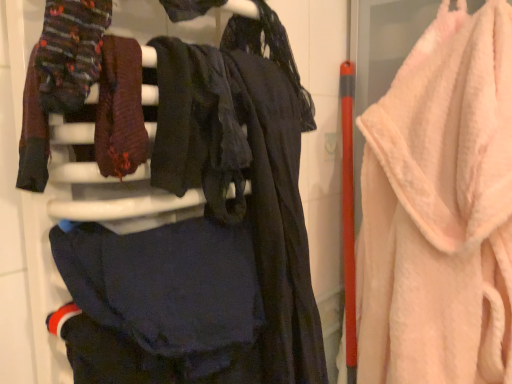
Locate an element on the screen. Image resolution: width=512 pixels, height=384 pixels. dark matte fabric at center, the 2th clothing in the top-to-bottom sequence is located at coordinates (160, 302).

Measure the distance between point (76,54) and camera.

Point (76,54) is 16.73 inches from camera.

Describe the element at coordinates (256, 264) in the screenshot. I see `velvet black dress at center` at that location.

This screenshot has width=512, height=384. I want to click on pink fluffy towel at right, so click(440, 209).

Is dark matte fabric at center, the 2th clothing in the top-to-bottom sequence, facing away from knitted wool socks at upper left, which is counted as the 2th clothing, starting from the bottom?

No, dark matte fabric at center, the 2th clothing in the top-to-bottom sequence, is not facing away from knitted wool socks at upper left, which is counted as the 2th clothing, starting from the bottom.

How many degrees apart are the facing directions of dark matte fabric at center, the 2th clothing in the top-to-bottom sequence, and knitted wool socks at upper left, arranged as the 1th clothing when viewed from the top?

0.000159 degrees separate the facing orientations of dark matte fabric at center, the 2th clothing in the top-to-bottom sequence, and knitted wool socks at upper left, arranged as the 1th clothing when viewed from the top.

From the image's perspective, who appears lower, dark matte fabric at center, which ranks as the 1th clothing in bottom-to-top order, or knitted wool socks at upper left, which is counted as the 2th clothing, starting from the bottom?

dark matte fabric at center, which ranks as the 1th clothing in bottom-to-top order, from the image's perspective.

Is dark matte fabric at center, the 2th clothing in the top-to-bottom sequence, not close to knitted wool socks at upper left, arranged as the 1th clothing when viewed from the top?

They are positioned close to each other.

Measure the distance between velvet black dress at center and knitted wool socks at upper left, which is counted as the 2th clothing, starting from the bottom.

velvet black dress at center is 8.48 inches from knitted wool socks at upper left, which is counted as the 2th clothing, starting from the bottom.

Is velvet black dress at center facing towards knitted wool socks at upper left, arranged as the 1th clothing when viewed from the top?

Yes, velvet black dress at center is facing knitted wool socks at upper left, arranged as the 1th clothing when viewed from the top.

Considering the positions of objects velvet black dress at center and knitted wool socks at upper left, which is counted as the 2th clothing, starting from the bottom, in the image provided, who is behind, velvet black dress at center or knitted wool socks at upper left, which is counted as the 2th clothing, starting from the bottom,?

velvet black dress at center is further from the camera.

Considering the sizes of objects velvet black dress at center and knitted wool socks at upper left, arranged as the 1th clothing when viewed from the top, in the image provided, who is bigger, velvet black dress at center or knitted wool socks at upper left, arranged as the 1th clothing when viewed from the top,?

velvet black dress at center is bigger.

Considering the relative sizes of pink fluffy towel at right and knitted wool socks at upper left, arranged as the 1th clothing when viewed from the top, in the image provided, is pink fluffy towel at right wider than knitted wool socks at upper left, arranged as the 1th clothing when viewed from the top,?

Yes, pink fluffy towel at right is wider than knitted wool socks at upper left, arranged as the 1th clothing when viewed from the top.

From a real-world perspective, is pink fluffy towel at right physically located above or below knitted wool socks at upper left, arranged as the 1th clothing when viewed from the top?

Clearly, from a real-world perspective, pink fluffy towel at right is below knitted wool socks at upper left, arranged as the 1th clothing when viewed from the top.

Is pink fluffy towel at right closer to camera compared to dark matte fabric at center, which ranks as the 1th clothing in bottom-to-top order?

No, pink fluffy towel at right is behind dark matte fabric at center, which ranks as the 1th clothing in bottom-to-top order.

Could you tell me if pink fluffy towel at right is facing dark matte fabric at center, which ranks as the 1th clothing in bottom-to-top order?

Yes, pink fluffy towel at right is aimed at dark matte fabric at center, which ranks as the 1th clothing in bottom-to-top order.

Who is taller, pink fluffy towel at right or dark matte fabric at center, the 2th clothing in the top-to-bottom sequence?

pink fluffy towel at right is taller.

Which is more to the right, pink fluffy towel at right or dark matte fabric at center, which ranks as the 1th clothing in bottom-to-top order?

pink fluffy towel at right is more to the right.

Considering the positions of objects knitted wool socks at upper left, which is counted as the 2th clothing, starting from the bottom, and pink fluffy towel at right in the image provided, who is more to the left, knitted wool socks at upper left, which is counted as the 2th clothing, starting from the bottom, or pink fluffy towel at right?

knitted wool socks at upper left, which is counted as the 2th clothing, starting from the bottom, is more to the left.

Looking at their sizes, would you say knitted wool socks at upper left, which is counted as the 2th clothing, starting from the bottom, is wider or thinner than pink fluffy towel at right?

In the image, knitted wool socks at upper left, which is counted as the 2th clothing, starting from the bottom, appears to be more narrow than pink fluffy towel at right.

Relative to pink fluffy towel at right, is knitted wool socks at upper left, which is counted as the 2th clothing, starting from the bottom, in front or behind?

Visually, knitted wool socks at upper left, which is counted as the 2th clothing, starting from the bottom, is located in front of pink fluffy towel at right.

Is dark matte fabric at center, the 2th clothing in the top-to-bottom sequence, next to velvet black dress at center and touching it?

Yes, the surface of dark matte fabric at center, the 2th clothing in the top-to-bottom sequence, is in contact with velvet black dress at center.

Is dark matte fabric at center, which ranks as the 1th clothing in bottom-to-top order, in front of velvet black dress at center?

No, the depth of dark matte fabric at center, which ranks as the 1th clothing in bottom-to-top order, is greater than that of velvet black dress at center.

Considering the sizes of dark matte fabric at center, which ranks as the 1th clothing in bottom-to-top order, and velvet black dress at center in the image, is dark matte fabric at center, which ranks as the 1th clothing in bottom-to-top order, wider or thinner than velvet black dress at center?

In the image, dark matte fabric at center, which ranks as the 1th clothing in bottom-to-top order, appears to be more narrow than velvet black dress at center.

Is dark matte fabric at center, the 2th clothing in the top-to-bottom sequence, positioned beyond the bounds of velvet black dress at center?

No, most part of dark matte fabric at center, the 2th clothing in the top-to-bottom sequence, lies within velvet black dress at center.

Could you tell me if dark matte fabric at center, the 2th clothing in the top-to-bottom sequence, is facing pink fluffy towel at right?

No, dark matte fabric at center, the 2th clothing in the top-to-bottom sequence, does not turn towards pink fluffy towel at right.

Does dark matte fabric at center, the 2th clothing in the top-to-bottom sequence, contain pink fluffy towel at right?

Actually, pink fluffy towel at right is outside dark matte fabric at center, the 2th clothing in the top-to-bottom sequence.

Who is taller, dark matte fabric at center, which ranks as the 1th clothing in bottom-to-top order, or pink fluffy towel at right?

Result: With more height is pink fluffy towel at right.

Can you confirm if dark matte fabric at center, which ranks as the 1th clothing in bottom-to-top order, is bigger than pink fluffy towel at right?

No.

At what (x,y) coordinates should I click in order to perform the action: click on clothing behind the knitted wool socks at upper left, which is counted as the 2th clothing, starting from the bottom. Please return your answer as a coordinate pair (x, y). Looking at the image, I should click on (160, 302).

Locate an element on the screen. closet that is below the knitted wool socks at upper left, arranged as the 1th clothing when viewed from the top (from the image's perspective) is located at coordinates (256, 264).

Based on their spatial positions, is dark matte fabric at center, the 2th clothing in the top-to-bottom sequence, or knitted wool socks at upper left, which is counted as the 2th clothing, starting from the bottom, further from velvet black dress at center?

Based on the image, knitted wool socks at upper left, which is counted as the 2th clothing, starting from the bottom, appears to be further to velvet black dress at center.

Consider the image. Which object lies further to the anchor point dark matte fabric at center, the 2th clothing in the top-to-bottom sequence, pink fluffy towel at right or velvet black dress at center?

pink fluffy towel at right is further to dark matte fabric at center, the 2th clothing in the top-to-bottom sequence.

Based on their spatial positions, is velvet black dress at center or knitted wool socks at upper left, which is counted as the 2th clothing, starting from the bottom, further from dark matte fabric at center, the 2th clothing in the top-to-bottom sequence?

Among the two, knitted wool socks at upper left, which is counted as the 2th clothing, starting from the bottom, is located further to dark matte fabric at center, the 2th clothing in the top-to-bottom sequence.

Based on the photo, when comparing their distances from knitted wool socks at upper left, which is counted as the 2th clothing, starting from the bottom, does velvet black dress at center or dark matte fabric at center, the 2th clothing in the top-to-bottom sequence, seem further?

velvet black dress at center.

Looking at the image, which one is located closer to velvet black dress at center, knitted wool socks at upper left, which is counted as the 2th clothing, starting from the bottom, or dark matte fabric at center, the 2th clothing in the top-to-bottom sequence?

dark matte fabric at center, the 2th clothing in the top-to-bottom sequence.

In the scene shown: Looking at the image, which one is located closer to knitted wool socks at upper left, which is counted as the 2th clothing, starting from the bottom, velvet black dress at center or pink fluffy towel at right?

velvet black dress at center is positioned closer to the anchor knitted wool socks at upper left, which is counted as the 2th clothing, starting from the bottom.

Which object lies further to the anchor point pink fluffy towel at right, velvet black dress at center or dark matte fabric at center, which ranks as the 1th clothing in bottom-to-top order?

dark matte fabric at center, which ranks as the 1th clothing in bottom-to-top order.

Consider the image. Looking at the image, which one is located further to knitted wool socks at upper left, arranged as the 1th clothing when viewed from the top, dark matte fabric at center, which ranks as the 1th clothing in bottom-to-top order, or velvet black dress at center?

velvet black dress at center lies further to knitted wool socks at upper left, arranged as the 1th clothing when viewed from the top, than the other object.

Find the location of `closet between knitted wool socks at upper left, which is counted as the 2th clothing, starting from the bottom, and dark matte fabric at center, which ranks as the 1th clothing in bottom-to-top order, vertically`. closet between knitted wool socks at upper left, which is counted as the 2th clothing, starting from the bottom, and dark matte fabric at center, which ranks as the 1th clothing in bottom-to-top order, vertically is located at coordinates (256, 264).

You are a GUI agent. You are given a task and a screenshot of the screen. Output one action in this format:
    pyautogui.click(x=<x>, y=<y>)
    Task: Click on the closet situated between knitted wool socks at upper left, which is counted as the 2th clothing, starting from the bottom, and pink fluffy towel at right from left to right
    The image size is (512, 384).
    Given the screenshot: What is the action you would take?
    pyautogui.click(x=256, y=264)

Find the location of `clothing between knitted wool socks at upper left, which is counted as the 2th clothing, starting from the bottom, and pink fluffy towel at right from left to right`. clothing between knitted wool socks at upper left, which is counted as the 2th clothing, starting from the bottom, and pink fluffy towel at right from left to right is located at coordinates (160, 302).

Locate an element on the screen. Image resolution: width=512 pixels, height=384 pixels. clothing located between velvet black dress at center and pink fluffy towel at right in the left-right direction is located at coordinates (160, 302).